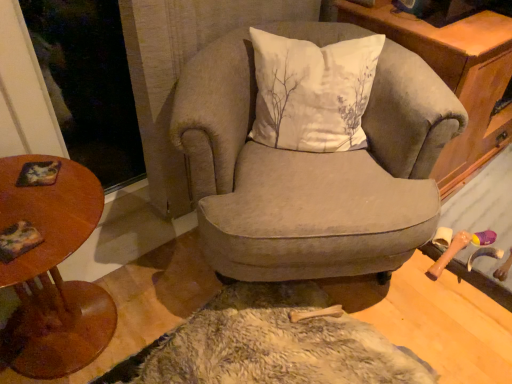
Question: From the image's perspective, is velvet gray armchair at center under wooden round table at left?

Choices:
 (A) no
 (B) yes

Answer: (A)

Question: Does velvet gray armchair at center have a lesser width compared to wooden round table at left?

Choices:
 (A) no
 (B) yes

Answer: (A)

Question: From the image's perspective, would you say velvet gray armchair at center is positioned over wooden round table at left?

Choices:
 (A) no
 (B) yes

Answer: (B)

Question: From a real-world perspective, is velvet gray armchair at center over wooden round table at left?

Choices:
 (A) no
 (B) yes

Answer: (B)

Question: Considering the relative sizes of velvet gray armchair at center and wooden round table at left in the image provided, is velvet gray armchair at center taller than wooden round table at left?

Choices:
 (A) no
 (B) yes

Answer: (B)

Question: Relative to wooden cabinet at upper right, is white cotton cushion at center in front or behind?

Choices:
 (A) front
 (B) behind

Answer: (A)

Question: Considering the positions of white cotton cushion at center and wooden cabinet at upper right in the image, is white cotton cushion at center bigger or smaller than wooden cabinet at upper right?

Choices:
 (A) small
 (B) big

Answer: (A)

Question: From the image's perspective, relative to wooden cabinet at upper right, is white cotton cushion at center above or below?

Choices:
 (A) below
 (B) above

Answer: (A)

Question: From their relative heights in the image, would you say white cotton cushion at center is taller or shorter than wooden cabinet at upper right?

Choices:
 (A) short
 (B) tall

Answer: (A)

Question: From a real-world perspective, relative to white cotton cushion at center, is velvet gray armchair at center vertically above or below?

Choices:
 (A) below
 (B) above

Answer: (A)

Question: Is point (397, 256) closer or farther from the camera than point (338, 102)?

Choices:
 (A) closer
 (B) farther

Answer: (B)

Question: Considering the positions of velvet gray armchair at center and white cotton cushion at center in the image, is velvet gray armchair at center wider or thinner than white cotton cushion at center?

Choices:
 (A) thin
 (B) wide

Answer: (B)

Question: Considering the relative positions of velvet gray armchair at center and white cotton cushion at center in the image provided, is velvet gray armchair at center to the left or to the right of white cotton cushion at center?

Choices:
 (A) left
 (B) right

Answer: (A)

Question: Considering the positions of wooden round table at left and velvet gray armchair at center in the image, is wooden round table at left wider or thinner than velvet gray armchair at center?

Choices:
 (A) thin
 (B) wide

Answer: (A)

Question: Considering the positions of wooden round table at left and velvet gray armchair at center in the image, is wooden round table at left taller or shorter than velvet gray armchair at center?

Choices:
 (A) short
 (B) tall

Answer: (A)